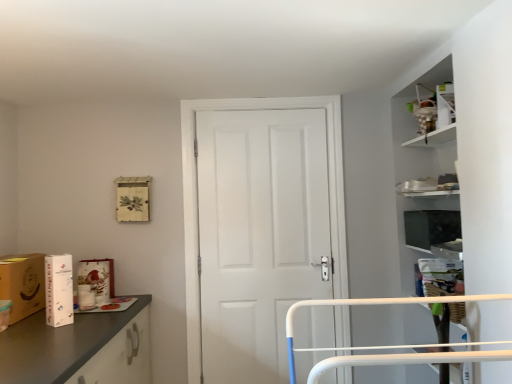
Question: Does white matte cardboard box at left, which ranks as the second cardboard box in left-to-right order, appear on the right side of white cardboard box at left?

Choices:
 (A) yes
 (B) no

Answer: (A)

Question: Is white matte cardboard box at left, which ranks as the second cardboard box in left-to-right order, located outside white cardboard box at left?

Choices:
 (A) yes
 (B) no

Answer: (A)

Question: From the image's perspective, would you say white matte cardboard box at left, which ranks as the second cardboard box in left-to-right order, is shown under white cardboard box at left?

Choices:
 (A) no
 (B) yes

Answer: (A)

Question: Is white matte cardboard box at left, which ranks as the second cardboard box in left-to-right order, shorter than white cardboard box at left?

Choices:
 (A) yes
 (B) no

Answer: (B)

Question: Could you tell me if white matte cardboard box at left, which ranks as the second cardboard box in left-to-right order, is facing white cardboard box at left?

Choices:
 (A) no
 (B) yes

Answer: (A)

Question: Choose the correct answer: Is white cardboard box at left inside white matte door at center or outside it?

Choices:
 (A) outside
 (B) inside

Answer: (A)

Question: From the image's perspective, is white cardboard box at left above or below white matte door at center?

Choices:
 (A) below
 (B) above

Answer: (A)

Question: Is white cardboard box at left taller or shorter than white matte door at center?

Choices:
 (A) tall
 (B) short

Answer: (B)

Question: Considering the positions of point (108, 266) and point (184, 153), is point (108, 266) closer or farther from the camera than point (184, 153)?

Choices:
 (A) farther
 (B) closer

Answer: (B)

Question: From a real-world perspective, is white matte door at center above or below white matte cardboard box at left, which ranks as the second cardboard box in left-to-right order?

Choices:
 (A) below
 (B) above

Answer: (B)

Question: Does point (197, 362) appear closer or farther from the camera than point (68, 288)?

Choices:
 (A) closer
 (B) farther

Answer: (B)

Question: Is white matte door at center in front of or behind white matte cardboard box at left, the first cardboard box positioned from the right, in the image?

Choices:
 (A) behind
 (B) front

Answer: (A)

Question: In terms of size, does white matte door at center appear bigger or smaller than white matte cardboard box at left, the first cardboard box positioned from the right?

Choices:
 (A) small
 (B) big

Answer: (B)

Question: Looking at their shapes, would you say matte brown cardboard box at left, arranged as the second cardboard box when viewed from the right, is wider or thinner than white cardboard box at left?

Choices:
 (A) wide
 (B) thin

Answer: (A)

Question: Relative to white cardboard box at left, is matte brown cardboard box at left, arranged as the second cardboard box when viewed from the right, in front or behind?

Choices:
 (A) behind
 (B) front

Answer: (B)